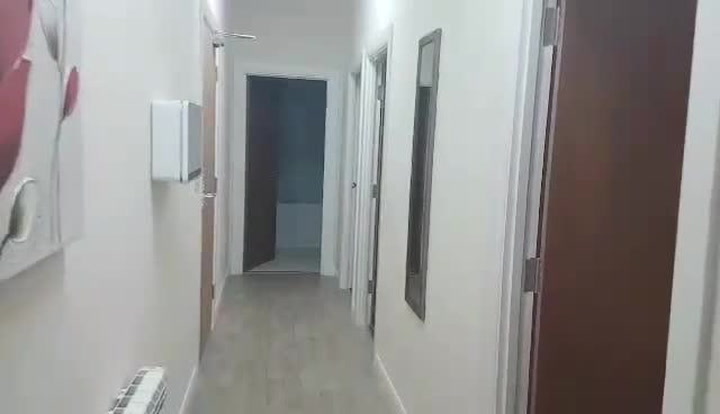
Where is `radiator`? This screenshot has height=414, width=720. radiator is located at coordinates (143, 387).